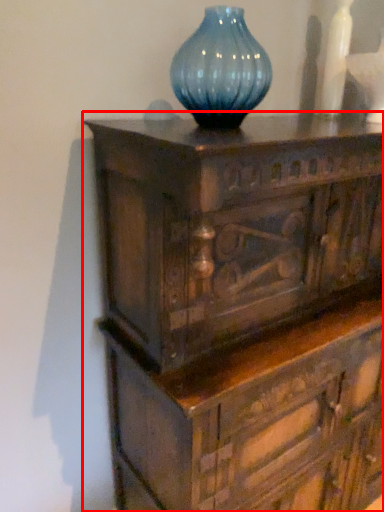
Question: From the image's perspective, what is the correct spatial relationship of chest of drawers (annotated by the red box) in relation to vase?

Choices:
 (A) above
 (B) below

Answer: (B)